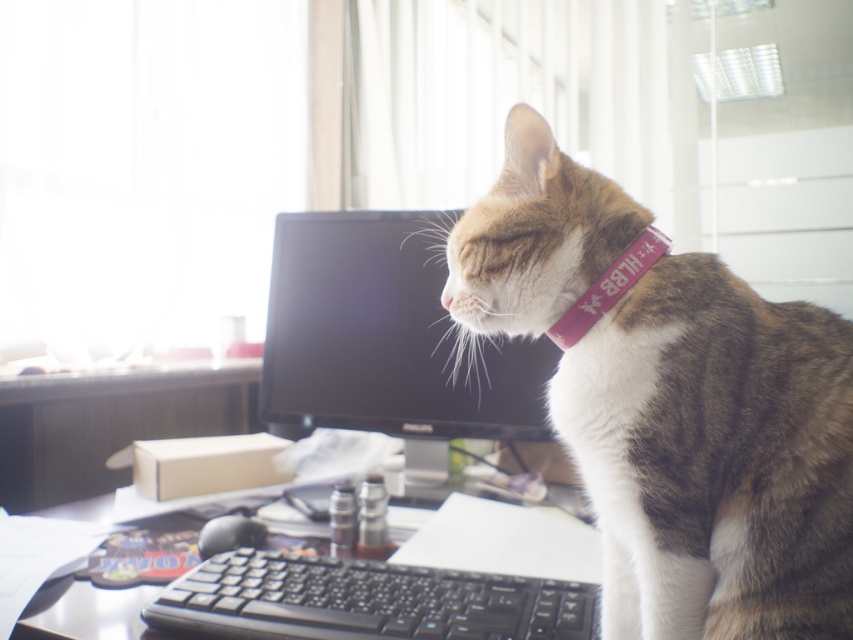
You are organizing the desk items and need to place the black plastic keyboard at lower center and the pink fabric neckband at upper center into a drawer. Which item will require more space in the drawer?

The black plastic keyboard at lower center requires more space in the drawer because it is bigger than the pink fabric neckband at upper center.

You are organizing the desk and want to place a new item between the black glossy monitor at center and the black plastic keyboard at lower center. Is there enough space for a 10 cm tall item?

The black glossy monitor at center is positioned over the black plastic keyboard at lower center, meaning there is no space between them. Therefore, a 10 cm tall item cannot be placed between them.

Based on the photo, you are organizing the desk and need to place a new item between the black glossy monitor at center and the black plastic keyboard at lower center. Which object should you place the item closer to if you want it to be near the larger object?

The black glossy monitor at center is bigger than the black plastic keyboard at lower center, so you should place the item closer to the black glossy monitor at center.